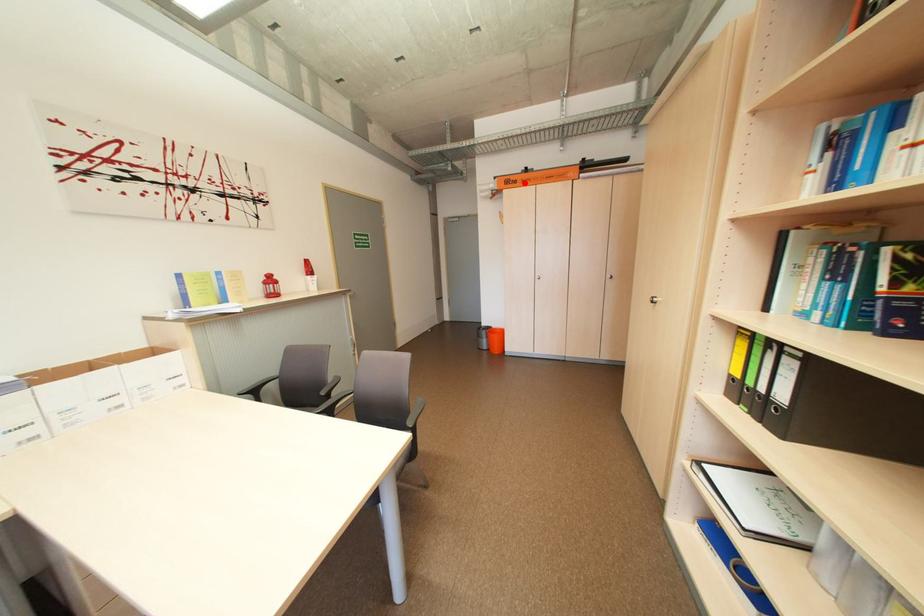
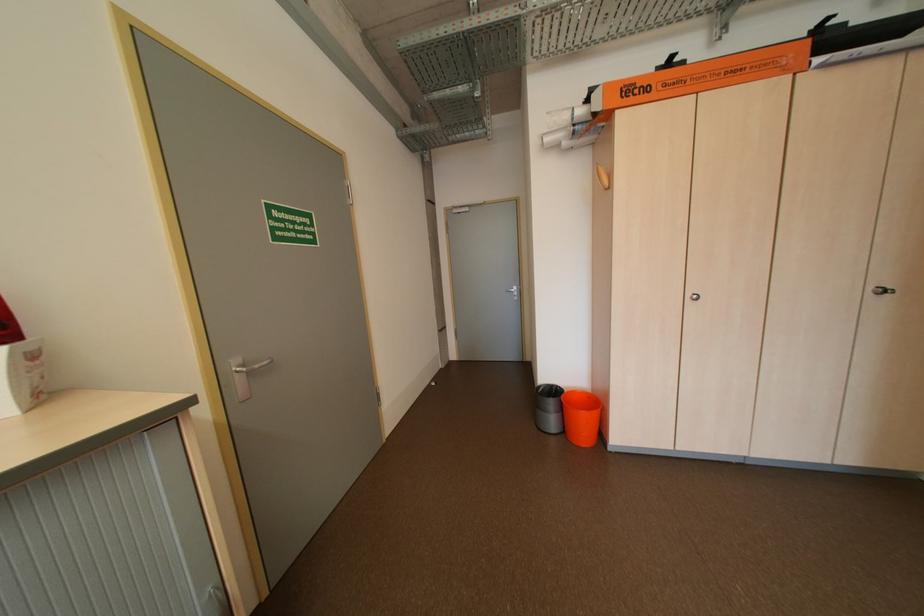
Locate, in the second image, the point that corresponds to the highlighted location in the first image.

(655, 90)